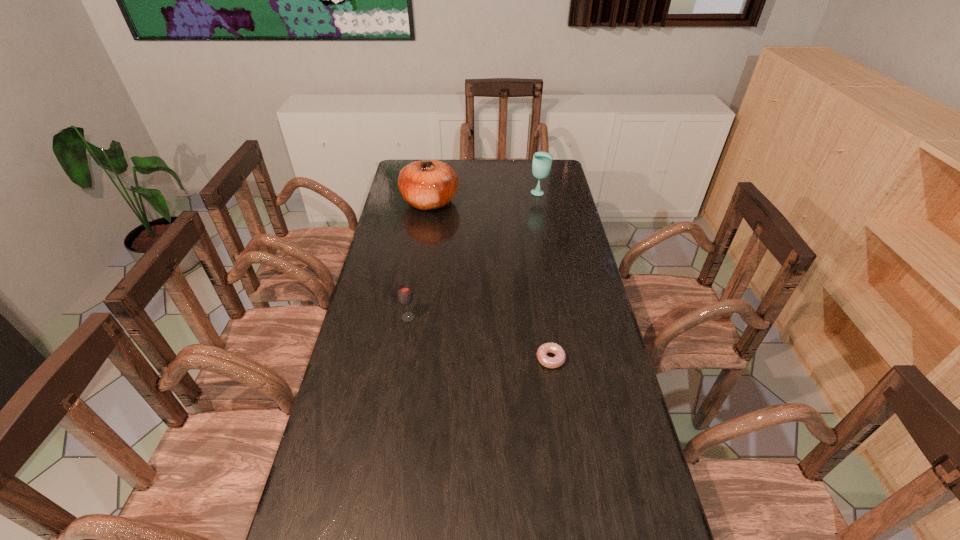
You are a GUI agent. You are given a task and a screenshot of the screen. Output one action in this format:
    pyautogui.click(x=<x>, y=<y>)
    Task: Click on the vacant space located on the left of the shortest object
    This screenshot has height=540, width=960.
    Given the screenshot: What is the action you would take?
    pyautogui.click(x=414, y=359)

Identify the location of pumpkin that is at the left edge. (430, 184).

Locate an element on the screen. The width and height of the screenshot is (960, 540). glass drink container at the left edge is located at coordinates (405, 297).

You are a GUI agent. You are given a task and a screenshot of the screen. Output one action in this format:
    pyautogui.click(x=<x>, y=<y>)
    Task: Click on the glass that is positioned at the right edge
    The width and height of the screenshot is (960, 540).
    Given the screenshot: What is the action you would take?
    pyautogui.click(x=542, y=161)

Locate an element on the screen. The height and width of the screenshot is (540, 960). doughnut at the right edge is located at coordinates pos(550,362).

This screenshot has width=960, height=540. I want to click on free space at the far edge, so click(x=461, y=159).

You are a GUI agent. You are given a task and a screenshot of the screen. Output one action in this format:
    pyautogui.click(x=<x>, y=<y>)
    Task: Click on the free space at the left edge of the desktop
    
    Given the screenshot: What is the action you would take?
    pyautogui.click(x=372, y=280)

Where is `vacant area at the right edge`? The height and width of the screenshot is (540, 960). vacant area at the right edge is located at coordinates (553, 196).

The height and width of the screenshot is (540, 960). What are the coordinates of `vacant region at the far left corner of the desktop` in the screenshot? It's located at (418, 160).

Find the location of a particular element. The height and width of the screenshot is (540, 960). free space between the farther glass drink container and the pumpkin is located at coordinates (485, 197).